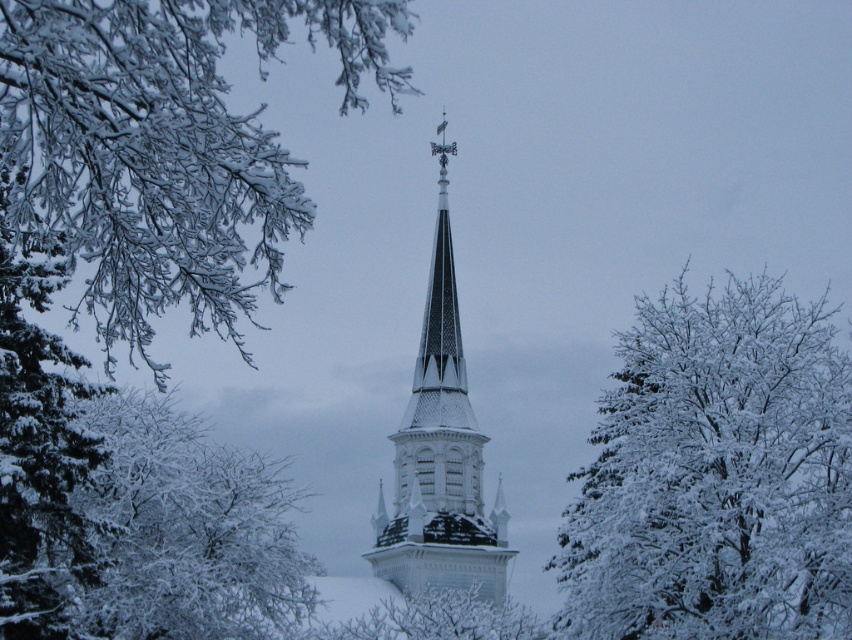
Which is behind, point (711, 394) or point (540, 634)?

The point (540, 634) is behind.

Consider the image. Which is above, snow-covered branches at upper right or snowy branches at center?

snow-covered branches at upper right

Where is `snow-covered branches at upper right`? snow-covered branches at upper right is located at coordinates (717, 474).

Does white frosty branches at lower left have a greater height compared to snowy branches at center?

Yes, white frosty branches at lower left is taller than snowy branches at center.

Is white frosty branches at lower left to the right of snowy branches at center from the viewer's perspective?

In fact, white frosty branches at lower left is to the left of snowy branches at center.

The width and height of the screenshot is (852, 640). Find the location of `white frosty branches at lower left`. white frosty branches at lower left is located at coordinates (185, 531).

Which of these two, snow-covered branches at upper left or snow-covered branches at left, stands shorter?

snow-covered branches at left

Does point (205, 259) come in front of point (22, 243)?

Yes, point (205, 259) is closer to viewer.

Find the location of `snow-covered branches at upper left`. snow-covered branches at upper left is located at coordinates (163, 148).